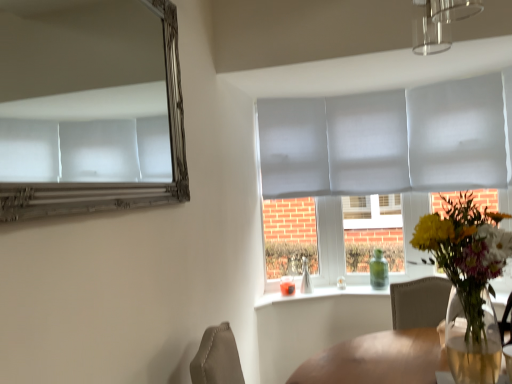
Question: From a real-world perspective, is silver metallic mirror at upper left physically above green glass bottle at window?

Choices:
 (A) yes
 (B) no

Answer: (A)

Question: Is silver metallic mirror at upper left positioned with its back to green glass bottle at window?

Choices:
 (A) no
 (B) yes

Answer: (A)

Question: Is the depth of silver metallic mirror at upper left less than that of green glass bottle at window?

Choices:
 (A) no
 (B) yes

Answer: (B)

Question: Is silver metallic mirror at upper left touching green glass bottle at window?

Choices:
 (A) yes
 (B) no

Answer: (B)

Question: Is silver metallic mirror at upper left smaller than green glass bottle at window?

Choices:
 (A) yes
 (B) no

Answer: (B)

Question: From the image's perspective, is translucent glass vase at center located above or below translucent glass vase at window?

Choices:
 (A) above
 (B) below

Answer: (A)

Question: Considering their positions, is translucent glass vase at center located in front of or behind translucent glass vase at window?

Choices:
 (A) behind
 (B) front

Answer: (B)

Question: Is translucent glass vase at center to the left or to the right of translucent glass vase at window in the image?

Choices:
 (A) left
 (B) right

Answer: (B)

Question: Is translucent glass vase at center inside the boundaries of translucent glass vase at window, or outside?

Choices:
 (A) inside
 (B) outside

Answer: (B)

Question: Looking at their shapes, would you say silver metallic mirror at upper left is wider or thinner than translucent glass vase at center?

Choices:
 (A) thin
 (B) wide

Answer: (A)

Question: Is point (153, 195) closer or farther from the camera than point (463, 355)?

Choices:
 (A) farther
 (B) closer

Answer: (A)

Question: Relative to translucent glass vase at center, is silver metallic mirror at upper left in front or behind?

Choices:
 (A) behind
 (B) front

Answer: (B)

Question: From their relative heights in the image, would you say silver metallic mirror at upper left is taller or shorter than translucent glass vase at center?

Choices:
 (A) short
 (B) tall

Answer: (B)

Question: In terms of height, does translucent glass vase at center look taller or shorter compared to matte gray glass door at center?

Choices:
 (A) short
 (B) tall

Answer: (A)

Question: From the image's perspective, is translucent glass vase at center located above or below matte gray glass door at center?

Choices:
 (A) above
 (B) below

Answer: (B)